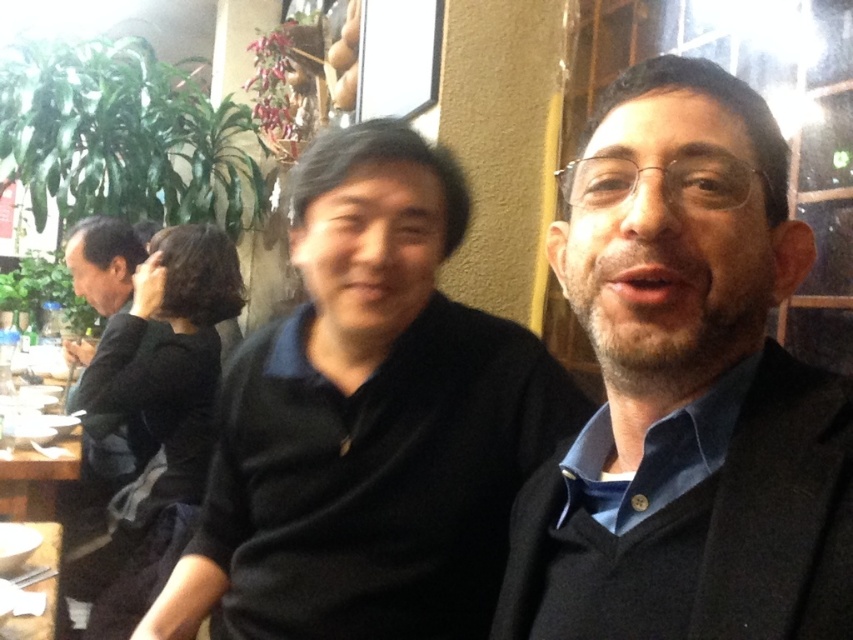
You are a photographer trying to capture a candid shot of the two people in the scene. You want to ensure that both subjects are in focus without any obstructions. Given their positions at point coordinates point (669, 496) and point (479, 342), which point should you position your camera closer to in order to have both subjects properly framed and in focus?

Point (669, 496) is in front of point (479, 342). To ensure both subjects are in focus and properly framed, position the camera closer to point (669, 496) since it is closer to the camera, allowing the depth of field to include both points effectively.

You are a photographer trying to capture a candid shot of the black matte shirt at left and the white glossy table at lower left. Which object will appear larger in the photo due to its actual size?

The black matte shirt at left is much taller than the white glossy table at lower left, so it will appear larger in the photo.

Looking at this image, you are a fashion designer observing two people in the scene described. You need to determine which clothing item is shorter in height between the dark blue sweater at center and the black matte shirt at center. Which one is shorter?

The dark blue sweater at center has a lesser height compared to the black matte shirt at center, so the dark blue sweater at center is shorter in height.